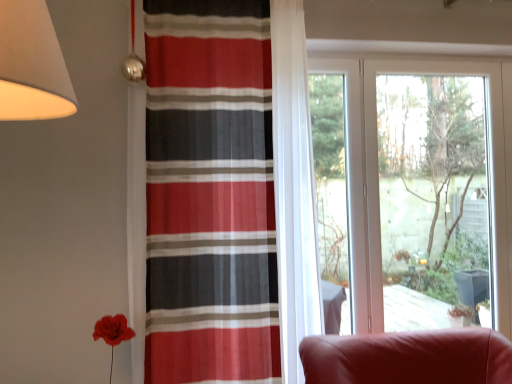
Measure the distance between point (463, 66) and camera.

Point (463, 66) is 8.20 feet away from camera.

Where is `transparent glass window at center`? The image size is (512, 384). transparent glass window at center is located at coordinates (377, 177).

What do you see at coordinates (377, 177) in the screenshot? The height and width of the screenshot is (384, 512). I see `transparent glass window at center` at bounding box center [377, 177].

Find the location of a particular element. This screenshot has height=384, width=512. striped fabric curtain at center is located at coordinates (210, 194).

This screenshot has height=384, width=512. What do you see at coordinates (210, 194) in the screenshot?
I see `striped fabric curtain at center` at bounding box center [210, 194].

The image size is (512, 384). What are the coordinates of `transparent glass window at center` in the screenshot? It's located at (377, 177).

Considering the relative positions of striped fabric curtain at center and transparent glass window at center in the image provided, is striped fabric curtain at center to the left of transparent glass window at center from the viewer's perspective?

Correct, you'll find striped fabric curtain at center to the left of transparent glass window at center.

Which object is more forward, striped fabric curtain at center or transparent glass window at center?

striped fabric curtain at center.

Is point (174, 52) farther from viewer compared to point (367, 304)?

No, (174, 52) is in front of (367, 304).

From the image's perspective, between striped fabric curtain at center and transparent glass window at center, who is located below?

transparent glass window at center appears lower in the image.

From a real-world perspective, who is located lower, striped fabric curtain at center or transparent glass window at center?

transparent glass window at center is physically lower.

Considering the sizes of striped fabric curtain at center and transparent glass window at center in the image, is striped fabric curtain at center wider or thinner than transparent glass window at center?

In the image, striped fabric curtain at center appears to be wider than transparent glass window at center.

Can you confirm if striped fabric curtain at center is shorter than transparent glass window at center?

No.

Who is bigger, striped fabric curtain at center or transparent glass window at center?

Bigger between the two is striped fabric curtain at center.

Would you say striped fabric curtain at center is inside or outside transparent glass window at center?

striped fabric curtain at center is not inside transparent glass window at center, it's outside.

Would you consider striped fabric curtain at center to be distant from transparent glass window at center?

No, striped fabric curtain at center is in close proximity to transparent glass window at center.

Is striped fabric curtain at center aimed at transparent glass window at center?

No, striped fabric curtain at center is not facing towards transparent glass window at center.

Measure the distance from striped fabric curtain at center to transparent glass window at center.

They are 35.50 inches apart.

You are a GUI agent. You are given a task and a screenshot of the screen. Output one action in this format:
    pyautogui.click(x=<x>, y=<y>)
    Task: Click on the window behind the striped fabric curtain at center
    
    Given the screenshot: What is the action you would take?
    pyautogui.click(x=377, y=177)

Between transparent glass window at center and striped fabric curtain at center, which one appears on the right side from the viewer's perspective?

Positioned to the right is transparent glass window at center.

Is transparent glass window at center in front of or behind striped fabric curtain at center in the image?

transparent glass window at center is behind striped fabric curtain at center.

Does point (357, 181) appear closer or farther from the camera than point (230, 12)?

Clearly, point (357, 181) is more distant from the camera than point (230, 12).

From the image's perspective, between transparent glass window at center and striped fabric curtain at center, which one is located above?

striped fabric curtain at center, from the image's perspective.

From a real-world perspective, is transparent glass window at center above or below striped fabric curtain at center?

From a real-world perspective, transparent glass window at center is physically below striped fabric curtain at center.

Which object is wider, transparent glass window at center or striped fabric curtain at center?

With larger width is striped fabric curtain at center.

Is transparent glass window at center shorter than striped fabric curtain at center?

Correct, transparent glass window at center is not as tall as striped fabric curtain at center.

Is transparent glass window at center bigger than striped fabric curtain at center?

No, transparent glass window at center is not bigger than striped fabric curtain at center.

Is transparent glass window at center located outside striped fabric curtain at center?

transparent glass window at center is positioned outside striped fabric curtain at center.

Is transparent glass window at center beside striped fabric curtain at center?

transparent glass window at center and striped fabric curtain at center are not in contact.

Could you tell me if transparent glass window at center is facing striped fabric curtain at center?

No, transparent glass window at center is not oriented towards striped fabric curtain at center.

Can you tell me how much transparent glass window at center and striped fabric curtain at center differ in facing direction?

The facing directions of transparent glass window at center and striped fabric curtain at center are 2.83 degrees apart.

The height and width of the screenshot is (384, 512). Find the location of `window that is behind the striped fabric curtain at center`. window that is behind the striped fabric curtain at center is located at coordinates (377, 177).

I want to click on curtain lying above the transparent glass window at center (from the image's perspective), so click(x=210, y=194).

Locate an element on the screen. The image size is (512, 384). window below the striped fabric curtain at center (from a real-world perspective) is located at coordinates [x=377, y=177].